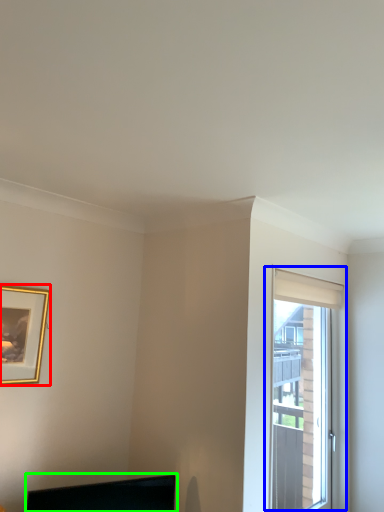
Question: Based on their relative distances, which object is nearer to picture frame (highlighted by a red box)? Choose from window (highlighted by a blue box) and computer monitor (highlighted by a green box).

Choices:
 (A) window
 (B) computer monitor

Answer: (B)